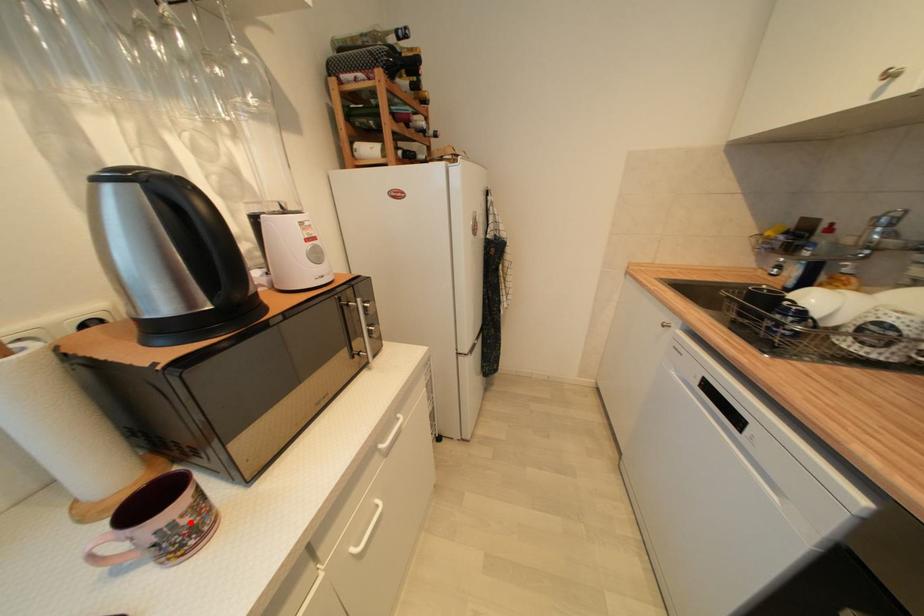
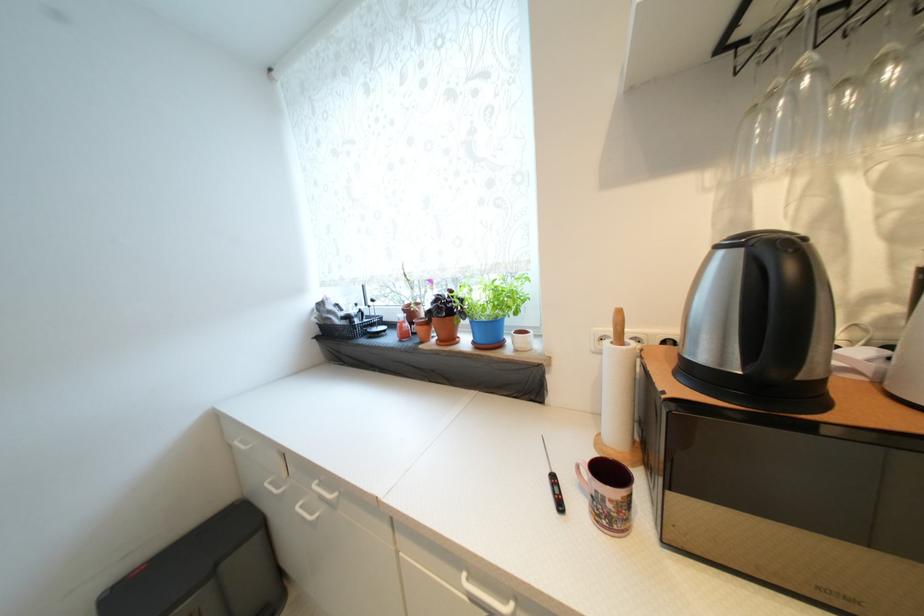
Locate, in the second image, the point that corresponds to the highlighted location in the first image.

(614, 508)